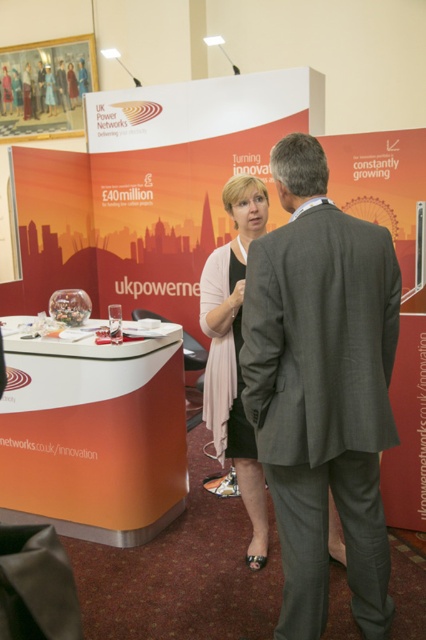
You are at the UK Power Networks booth and see a gray wool suit at center and a pink fabric dress at center. Which one is positioned more to the right?

The gray wool suit at center is positioned to the right of the pink fabric dress at center.

You are standing at the UK Power Networks booth and want to take a photo of the two points on the table. Which point, point (x=322, y=598) or point (x=241, y=477), will appear larger in your photo?

Point (x=322, y=598) will appear larger in the photo because it is closer to the camera than point (x=241, y=477).